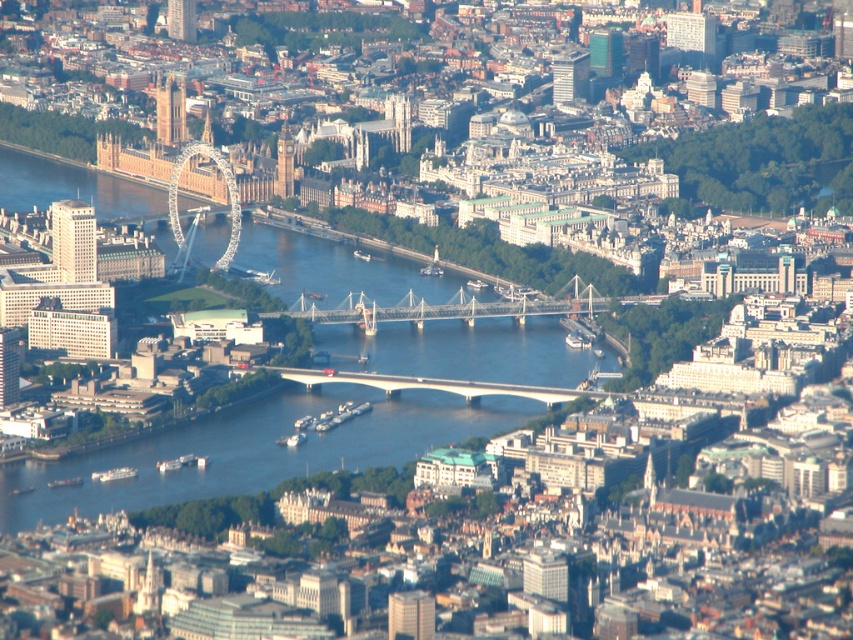
You are a drone operator tasked with capturing a photo of the London Eye and the Houses of Parliament. Your drone is currently above the blue water at center. To frame both landmarks in your shot, should you move your drone north or south? Please explain your reasoning based on their relative positions.

The blue water at center is located at point (254, 451). Since the London Eye and Houses of Parliament are on the left side of the image, moving north would position the drone closer to them, allowing both landmarks to be framed in the shot.